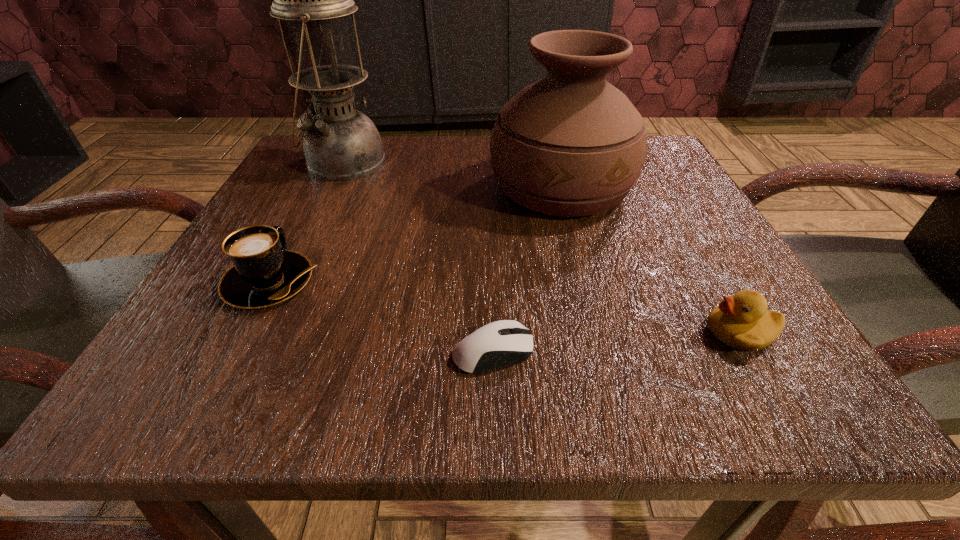
Locate which object is the fourth closest to the fourth shortest object. Please provide its 2D coordinates. Your answer should be formatted as a tuple, i.e. [(x, y)], where the tuple contains the x and y coordinates of a point satisfying the conditions above.

[(264, 273)]